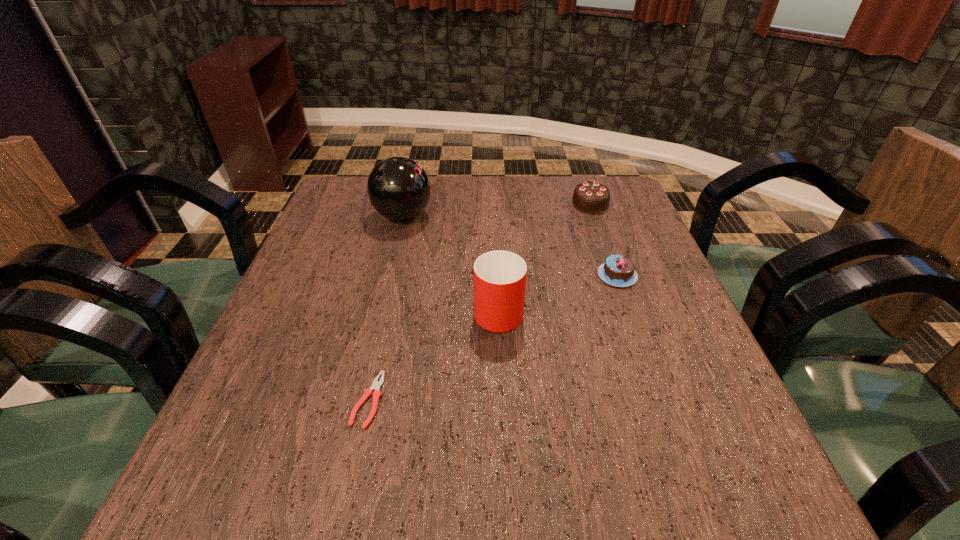
Identify the location of free space that satisfies the following two spatial constraints: 1. on the side of the taller chocolate cake with the handle; 2. on the left side of the third object from right to left. (493, 204).

Where is `vacant position in the image that satisfies the following two spatial constraints: 1. on the side of the second tallest object with the handle; 2. on the right side of the taller chocolate cake`? This screenshot has height=540, width=960. vacant position in the image that satisfies the following two spatial constraints: 1. on the side of the second tallest object with the handle; 2. on the right side of the taller chocolate cake is located at coordinates (493, 204).

The height and width of the screenshot is (540, 960). Identify the location of vacant position in the image that satisfies the following two spatial constraints: 1. on the surface of the bowling ball near the finger holes; 2. on the right side of the nearest object. (359, 400).

At what (x,y) coordinates should I click in order to perform the action: click on free space that satisfies the following two spatial constraints: 1. on the side of the second tallest object with the handle; 2. on the left side of the third shortest object. Please return your answer as a coordinate pair (x, y). Looking at the image, I should click on (493, 204).

At what (x,y) coordinates should I click in order to perform the action: click on vacant space that satisfies the following two spatial constraints: 1. on the back side of the shorter chocolate cake; 2. on the surface of the tallest object near the finger holes. Please return your answer as a coordinate pair (x, y). The image size is (960, 540). Looking at the image, I should click on (596, 215).

Where is `free point that satisfies the following two spatial constraints: 1. on the side of the cup with the handle; 2. on the right side of the nearer chocolate cake`? free point that satisfies the following two spatial constraints: 1. on the side of the cup with the handle; 2. on the right side of the nearer chocolate cake is located at coordinates (496, 275).